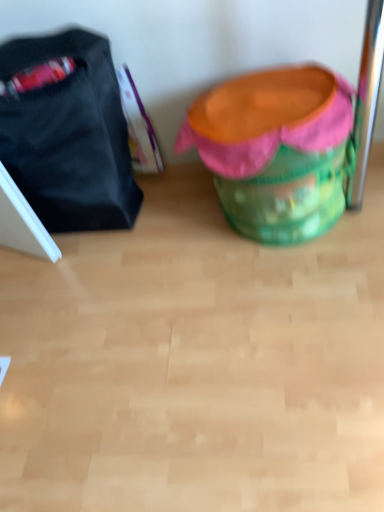
Describe the element at coordinates (67, 131) in the screenshot. I see `matte black bag at left` at that location.

Identify the location of matte black bag at left. (67, 131).

In order to face matte black bag at left, should I rotate leftwards or rightwards?

To face it directly, rotate left by 17.793 degrees.

At what (x,y) coordinates should I click in order to perform the action: click on green fabric bean bag chair at center. Please return your answer as a coordinate pair (x, y). The image size is (384, 512). Looking at the image, I should click on (275, 150).

What do you see at coordinates (275, 150) in the screenshot? The image size is (384, 512). I see `green fabric bean bag chair at center` at bounding box center [275, 150].

Identify the location of matte black bag at left. This screenshot has height=512, width=384. (67, 131).

Considering the relative positions of green fabric bean bag chair at center and matte black bag at left in the image provided, is green fabric bean bag chair at center to the left or to the right of matte black bag at left?

green fabric bean bag chair at center is to the right of matte black bag at left.

Is the depth of green fabric bean bag chair at center less than that of matte black bag at left?

Yes, green fabric bean bag chair at center is closer to the viewer.

Is point (307, 98) farther from viewer compared to point (106, 151)?

No, it is in front of (106, 151).

From the image's perspective, is green fabric bean bag chair at center above or below matte black bag at left?

Based on their image positions, green fabric bean bag chair at center is located beneath matte black bag at left.

Looking at this image, from a real-world perspective, is green fabric bean bag chair at center positioned above or below matte black bag at left?

green fabric bean bag chair at center is below matte black bag at left.

Is green fabric bean bag chair at center thinner than matte black bag at left?

No, green fabric bean bag chair at center is not thinner than matte black bag at left.

Considering the relative sizes of green fabric bean bag chair at center and matte black bag at left in the image provided, is green fabric bean bag chair at center shorter than matte black bag at left?

Yes, green fabric bean bag chair at center is shorter than matte black bag at left.

Who is smaller, green fabric bean bag chair at center or matte black bag at left?

matte black bag at left is smaller.

Would you say green fabric bean bag chair at center contains matte black bag at left?

No.

Are green fabric bean bag chair at center and matte black bag at left located far from each other?

No, green fabric bean bag chair at center is in close proximity to matte black bag at left.

Could you tell me if green fabric bean bag chair at center is facing matte black bag at left?

No, green fabric bean bag chair at center does not turn towards matte black bag at left.

Identify the location of bean bag chair on the right of matte black bag at left. (275, 150).

Is matte black bag at left to the right of green fabric bean bag chair at center from the viewer's perspective?

Incorrect, matte black bag at left is not on the right side of green fabric bean bag chair at center.

Considering the positions of objects matte black bag at left and green fabric bean bag chair at center in the image provided, who is in front, matte black bag at left or green fabric bean bag chair at center?

green fabric bean bag chair at center is more forward.

Is point (89, 57) closer to camera compared to point (326, 224)?

Yes, it is.

From the picture: From the image's perspective, would you say matte black bag at left is shown under green fabric bean bag chair at center?

No, from the image's perspective, matte black bag at left is not beneath green fabric bean bag chair at center.

From a real-world perspective, is matte black bag at left on top of green fabric bean bag chair at center?

Indeed, from a real-world perspective, matte black bag at left stands above green fabric bean bag chair at center.

Considering the sizes of objects matte black bag at left and green fabric bean bag chair at center in the image provided, who is wider, matte black bag at left or green fabric bean bag chair at center?

green fabric bean bag chair at center.

Considering the sizes of objects matte black bag at left and green fabric bean bag chair at center in the image provided, who is taller, matte black bag at left or green fabric bean bag chair at center?

matte black bag at left is taller.

Consider the image. Between matte black bag at left and green fabric bean bag chair at center, which one has smaller size?

matte black bag at left is smaller.

Would you say matte black bag at left is inside or outside green fabric bean bag chair at center?

matte black bag at left is outside green fabric bean bag chair at center.

Is there a large distance between matte black bag at left and green fabric bean bag chair at center?

matte black bag at left is near green fabric bean bag chair at center, not far away.

Could you tell me if matte black bag at left is turned towards green fabric bean bag chair at center?

No, matte black bag at left is not aimed at green fabric bean bag chair at center.

What's the angular difference between matte black bag at left and green fabric bean bag chair at center's facing directions?

The facing directions of matte black bag at left and green fabric bean bag chair at center are 2.88 degrees apart.

This screenshot has height=512, width=384. In order to click on bean bag chair located below the matte black bag at left (from the image's perspective) in this screenshot , I will do `click(275, 150)`.

In order to click on luggage and bags lying behind the green fabric bean bag chair at center in this screenshot , I will do `click(67, 131)`.

Image resolution: width=384 pixels, height=512 pixels. In order to click on bean bag chair that is in front of the matte black bag at left in this screenshot , I will do `click(275, 150)`.